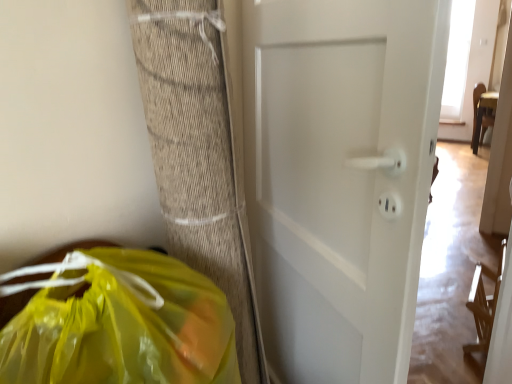
Question: Is white matte door at center behind translucent yellow plastic bag at lower left?

Choices:
 (A) no
 (B) yes

Answer: (B)

Question: Is white matte door at center bigger than translucent yellow plastic bag at lower left?

Choices:
 (A) yes
 (B) no

Answer: (A)

Question: Does white matte door at center have a smaller size compared to translucent yellow plastic bag at lower left?

Choices:
 (A) no
 (B) yes

Answer: (A)

Question: Is white matte door at center closer to camera compared to translucent yellow plastic bag at lower left?

Choices:
 (A) yes
 (B) no

Answer: (B)

Question: Is white matte door at center aimed at translucent yellow plastic bag at lower left?

Choices:
 (A) yes
 (B) no

Answer: (B)

Question: Would you say translucent yellow plastic bag at lower left is part of white matte door at center's contents?

Choices:
 (A) no
 (B) yes

Answer: (A)

Question: From the image's perspective, would you say translucent yellow plastic bag at lower left is positioned over white matte door at center?

Choices:
 (A) no
 (B) yes

Answer: (A)

Question: Is translucent yellow plastic bag at lower left with white matte door at center?

Choices:
 (A) no
 (B) yes

Answer: (A)

Question: Can you confirm if translucent yellow plastic bag at lower left is smaller than white matte door at center?

Choices:
 (A) no
 (B) yes

Answer: (B)

Question: Is translucent yellow plastic bag at lower left wider than white matte door at center?

Choices:
 (A) yes
 (B) no

Answer: (A)

Question: From the image's perspective, does translucent yellow plastic bag at lower left appear lower than white matte door at center?

Choices:
 (A) no
 (B) yes

Answer: (B)

Question: Is translucent yellow plastic bag at lower left oriented away from white matte door at center?

Choices:
 (A) no
 (B) yes

Answer: (A)

Question: From their relative heights in the image, would you say white matte door at center is taller or shorter than translucent yellow plastic bag at lower left?

Choices:
 (A) short
 (B) tall

Answer: (B)